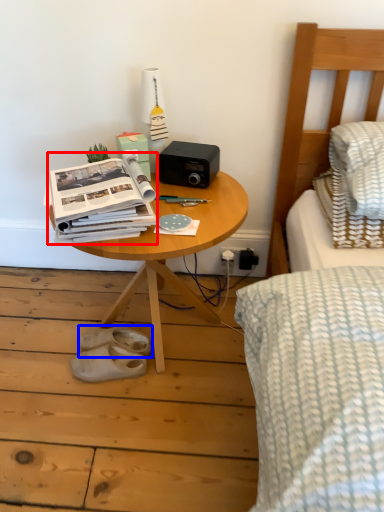
Question: Which object appears closest to the camera in this image, paperback book (highlighted by a red box) or footwear (highlighted by a blue box)?

Choices:
 (A) paperback book
 (B) footwear

Answer: (A)